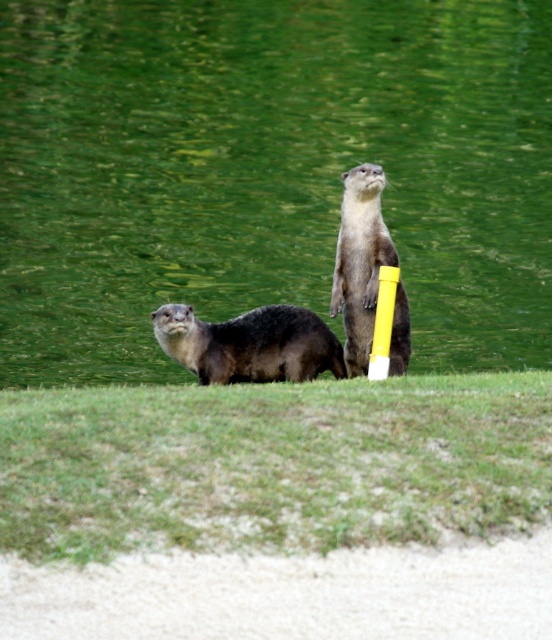
Question: Among these objects, which one is farthest from the camera?

Choices:
 (A) green water at center
 (B) soft brown fur otter at center
 (C) shiny brown otter at center

Answer: (A)

Question: Is green water at center to the left of shiny brown otter at center from the viewer's perspective?

Choices:
 (A) no
 (B) yes

Answer: (B)

Question: Based on their relative distances, which object is nearer to the shiny brown otter at center?

Choices:
 (A) soft brown fur otter at center
 (B) green water at center

Answer: (A)

Question: Which object is positioned closest to the shiny brown otter at center?

Choices:
 (A) green water at center
 (B) soft brown fur otter at center

Answer: (B)

Question: Does green water at center have a lesser width compared to shiny brown otter at center?

Choices:
 (A) no
 (B) yes

Answer: (A)

Question: Can you confirm if green water at center is bigger than shiny brown otter at center?

Choices:
 (A) yes
 (B) no

Answer: (A)